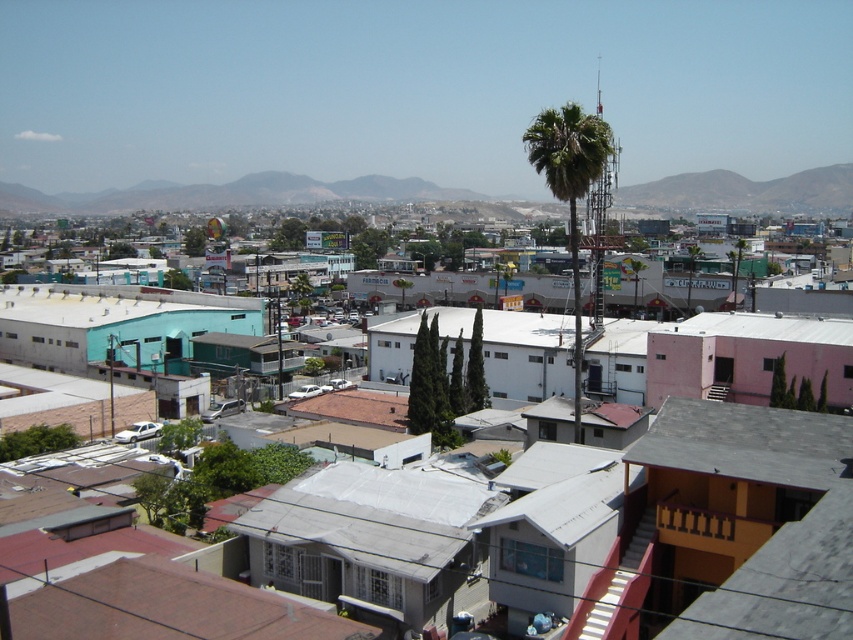
Question: Which of the following is the farthest from the observer?

Choices:
 (A) green leafy palm tree at center-right
 (B) gray/rocky mountain at upper center

Answer: (B)

Question: Does gray/rocky mountain at upper center lie behind green leafy palm tree at center-right?

Choices:
 (A) yes
 (B) no

Answer: (A)

Question: Does gray/rocky mountain at upper center have a greater width compared to green leafy palm tree at center-right?

Choices:
 (A) yes
 (B) no

Answer: (A)

Question: Which object is farther from the camera taking this photo?

Choices:
 (A) brown tile roof at lower left
 (B) green leafy palm tree at center-right
 (C) gray/rocky mountain at upper center

Answer: (C)

Question: Which object is closer to the camera taking this photo?

Choices:
 (A) brown tile roof at lower left
 (B) gray/rocky mountain at upper center

Answer: (A)

Question: Can you confirm if gray/rocky mountain at upper center is positioned to the left of green leafy palm tree at center-right?

Choices:
 (A) yes
 (B) no

Answer: (A)